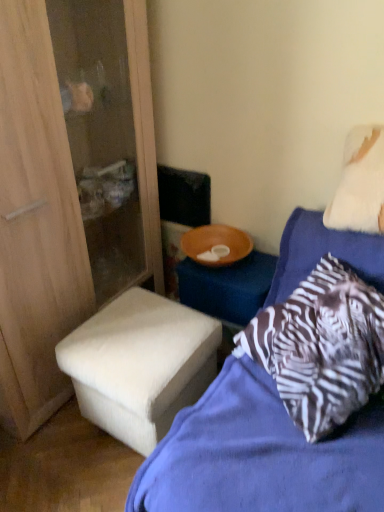
Question: Considering their positions, is zebra-patterned pillow at upper right located in front of or behind white fabric ottoman at lower left?

Choices:
 (A) front
 (B) behind

Answer: (A)

Question: From the image's perspective, is zebra-patterned pillow at upper right above or below white fabric ottoman at lower left?

Choices:
 (A) above
 (B) below

Answer: (B)

Question: Considering the real-world distances, which object is closest to the zebra-patterned pillow at upper right?

Choices:
 (A) white fluffy pillow at upper right
 (B) white fabric stool at lower left
 (C) white fabric ottoman at lower left

Answer: (B)

Question: Estimate the real-world distances between objects in this image. Which object is closer to the white fluffy pillow at upper right?

Choices:
 (A) zebra-patterned pillow at upper right
 (B) white fabric ottoman at lower left
 (C) white fabric stool at lower left

Answer: (A)